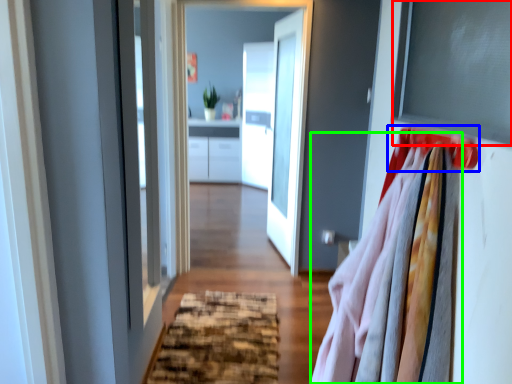
Question: Which is farther away from window screen (highlighted by a red box)? hanger (highlighted by a blue box) or clothing (highlighted by a green box)?

Choices:
 (A) hanger
 (B) clothing

Answer: (B)